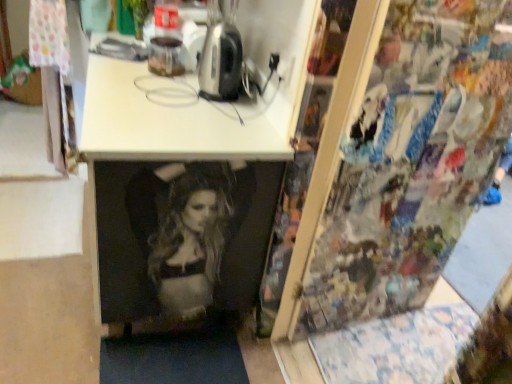
Where is `metallic silver toaster at upper center`? This screenshot has width=512, height=384. metallic silver toaster at upper center is located at coordinates (221, 53).

In order to face metallic silver toaster at upper center, should I rotate leftwards or rightwards?

Turn left by 3.930 degrees to look at metallic silver toaster at upper center.

Describe the element at coordinates (221, 53) in the screenshot. I see `metallic silver toaster at upper center` at that location.

Describe the element at coordinates (175, 119) in the screenshot. The width and height of the screenshot is (512, 384). I see `white plastic iron at upper center` at that location.

Find the location of a particular element. white plastic iron at upper center is located at coordinates (175, 119).

Where is `metallic silver toaster at upper center`? metallic silver toaster at upper center is located at coordinates (221, 53).

Based on their positions, is metallic silver toaster at upper center located to the left or right of white plastic iron at upper center?

metallic silver toaster at upper center is positioned on white plastic iron at upper center's right side.

Who is more distant, metallic silver toaster at upper center or white plastic iron at upper center?

Positioned behind is metallic silver toaster at upper center.

Between point (227, 45) and point (212, 120), which one is positioned in front?

The point (212, 120) is in front.

From the image's perspective, does metallic silver toaster at upper center appear lower than white plastic iron at upper center?

Actually, metallic silver toaster at upper center appears above white plastic iron at upper center in the image.

From a real-world perspective, between metallic silver toaster at upper center and white plastic iron at upper center, who is vertically lower?

white plastic iron at upper center is physically lower.

Between metallic silver toaster at upper center and white plastic iron at upper center, which one has smaller width?

metallic silver toaster at upper center.

Is metallic silver toaster at upper center taller than white plastic iron at upper center?

Correct, metallic silver toaster at upper center is much taller as white plastic iron at upper center.

Between metallic silver toaster at upper center and white plastic iron at upper center, which one has smaller size?

With smaller size is metallic silver toaster at upper center.

Is metallic silver toaster at upper center not within white plastic iron at upper center?

That's correct, metallic silver toaster at upper center is outside of white plastic iron at upper center.

Is metallic silver toaster at upper center with white plastic iron at upper center?

There is a gap between metallic silver toaster at upper center and white plastic iron at upper center.

Based on the photo, is metallic silver toaster at upper center looking in the opposite direction of white plastic iron at upper center?

metallic silver toaster at upper center does not have its back to white plastic iron at upper center.

What's the angular difference between metallic silver toaster at upper center and white plastic iron at upper center's facing directions?

2.25 degrees.

Locate an element on the screen. This screenshot has height=384, width=512. counter top on the left of metallic silver toaster at upper center is located at coordinates (175, 119).

Would you say white plastic iron at upper center is to the left or to the right of metallic silver toaster at upper center in the picture?

Based on their positions, white plastic iron at upper center is located to the left of metallic silver toaster at upper center.

Considering the positions of objects white plastic iron at upper center and metallic silver toaster at upper center in the image provided, who is in front, white plastic iron at upper center or metallic silver toaster at upper center?

white plastic iron at upper center is closer to the camera.

Is point (134, 159) closer to camera compared to point (218, 6)?

Yes, point (134, 159) is in front of point (218, 6).

From the image's perspective, does white plastic iron at upper center appear higher than metallic silver toaster at upper center?

No, from the image's perspective, white plastic iron at upper center is not above metallic silver toaster at upper center.

From a real-world perspective, who is located higher, white plastic iron at upper center or metallic silver toaster at upper center?

metallic silver toaster at upper center.

Is white plastic iron at upper center wider or thinner than metallic silver toaster at upper center?

Considering their sizes, white plastic iron at upper center looks broader than metallic silver toaster at upper center.

Between white plastic iron at upper center and metallic silver toaster at upper center, which one has less height?

white plastic iron at upper center is shorter.

Consider the image. Between white plastic iron at upper center and metallic silver toaster at upper center, which one has smaller size?

metallic silver toaster at upper center.

Is metallic silver toaster at upper center surrounded by white plastic iron at upper center?

No, metallic silver toaster at upper center is not a part of white plastic iron at upper center.

Are white plastic iron at upper center and metallic silver toaster at upper center making contact?

They are not placed beside each other.

Could you tell me if white plastic iron at upper center is facing metallic silver toaster at upper center?

No, white plastic iron at upper center does not turn towards metallic silver toaster at upper center.

Identify the location of appliance above the white plastic iron at upper center (from a real-world perspective). [221, 53].

Image resolution: width=512 pixels, height=384 pixels. Identify the location of counter top below the metallic silver toaster at upper center (from a real-world perspective). (175, 119).

Locate an element on the screen. Image resolution: width=512 pixels, height=384 pixels. appliance located on the right of white plastic iron at upper center is located at coordinates pyautogui.click(x=221, y=53).